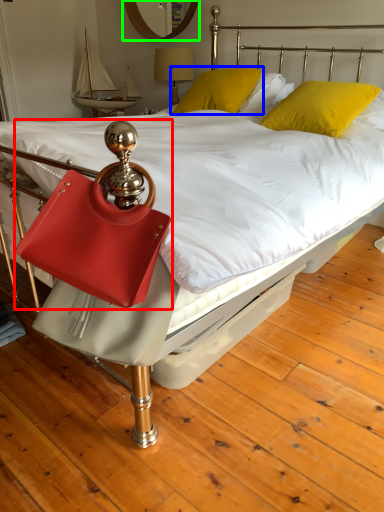
Question: Considering the real-world distances, which object is farthest from handbag (highlighted by a red box)? pillow (highlighted by a blue box) or mirror (highlighted by a green box)?

Choices:
 (A) pillow
 (B) mirror

Answer: (B)